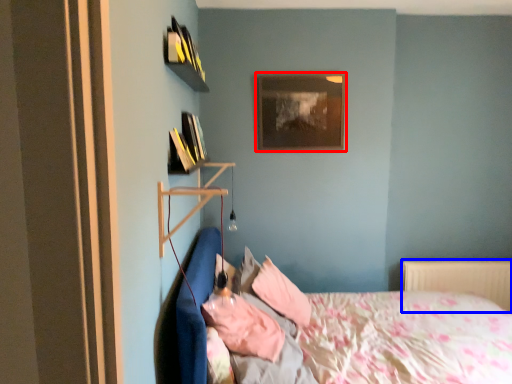
Question: Which of the following is the closest to the observer, picture frame (highlighted by a red box) or radiator (highlighted by a blue box)?

Choices:
 (A) picture frame
 (B) radiator

Answer: (A)